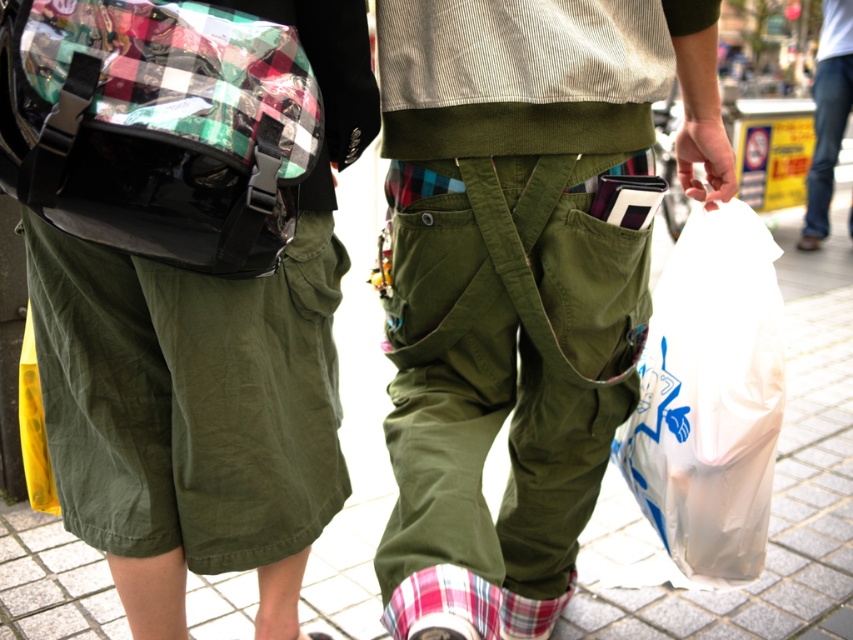
Based on the photo, you are a pedestrian walking behind the two individuals. You notice the olive green canvas pocket at center and the transparent plastic bag at lower right. Which one is closer to you?

The transparent plastic bag at lower right is closer to you because the olive green canvas pocket at center is behind it.

You are a delivery person who needs to choose between the plaid fabric bag at left and the olive green canvas pocket at center to carry a fragile item. Which bag should you choose based on their sizes?

The olive green canvas pocket at center is larger than the plaid fabric bag at left, so you should choose the olive green canvas pocket at center to carry the fragile item as it provides more space for protection.

You are a photographer trying to capture both the plaid fabric bag at left and the transparent plastic bag at lower right in a single shot. Based on their positions, which bag would appear closer to the camera in the photo?

The plaid fabric bag at left appears closer to the camera because it is located above the transparent plastic bag at lower right, indicating it is positioned higher and thus nearer in the frame.